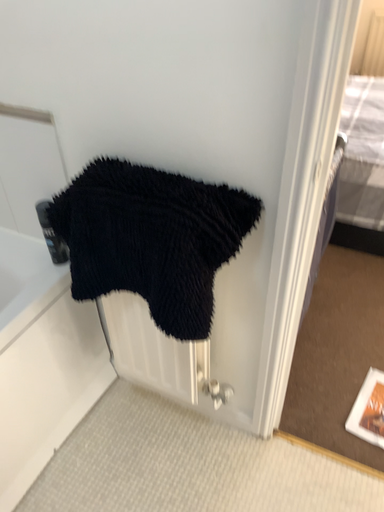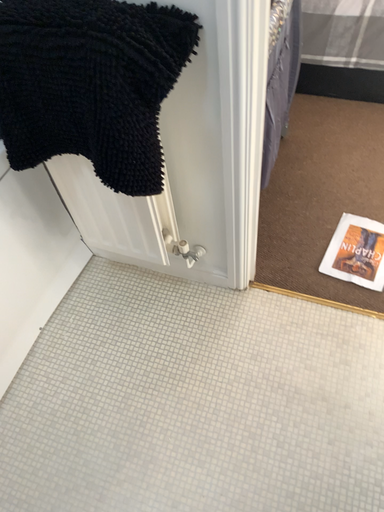
Question: Which way did the camera rotate in the video?

Choices:
 (A) rotated downward
 (B) rotated upward

Answer: (A)